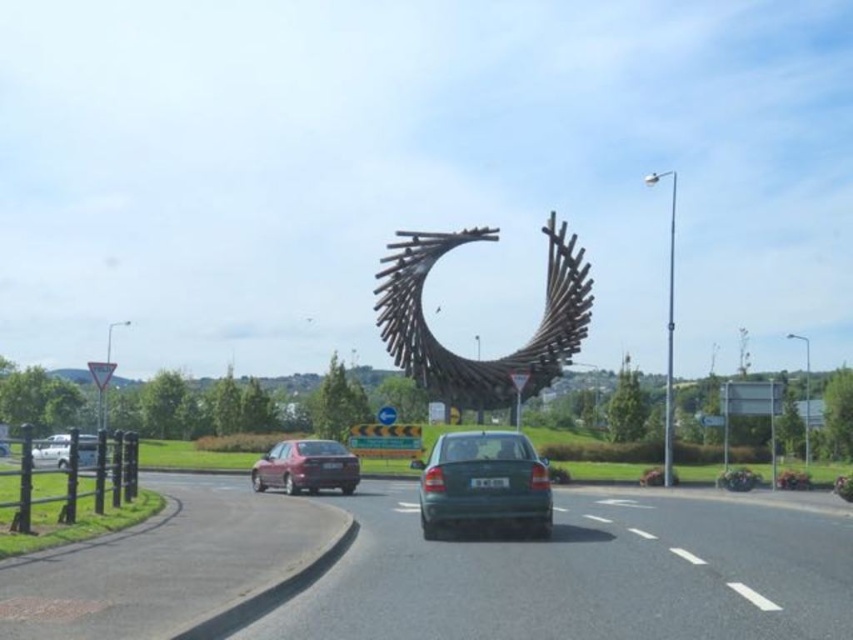
Question: Among these points, which one is nearest to the camera?

Choices:
 (A) pos(461,237)
 (B) pos(492,451)

Answer: (B)

Question: Is smooth asphalt road at center above white matte van at lower left?

Choices:
 (A) yes
 (B) no

Answer: (A)

Question: Does wooden sculpture at center come in front of green matte car at center?

Choices:
 (A) yes
 (B) no

Answer: (B)

Question: Which object is the closest to the white matte van at lower left?

Choices:
 (A) matte red sedan at left
 (B) green matte car at center

Answer: (A)

Question: Is wooden sculpture at center bigger than white matte van at lower left?

Choices:
 (A) yes
 (B) no

Answer: (B)

Question: Which point is closer to the camera?

Choices:
 (A) (433, 522)
 (B) (300, 476)

Answer: (A)